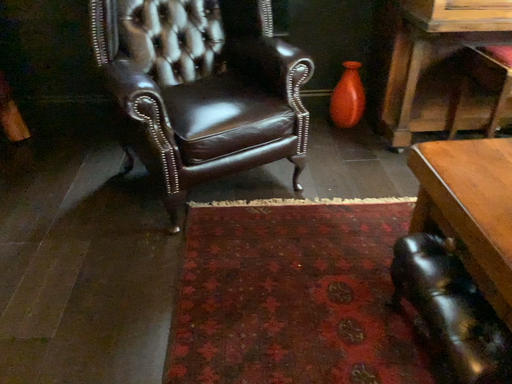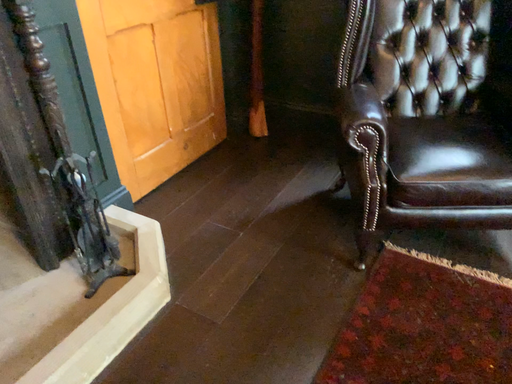
Question: Which way did the camera rotate in the video?

Choices:
 (A) rotated right
 (B) rotated left

Answer: (B)